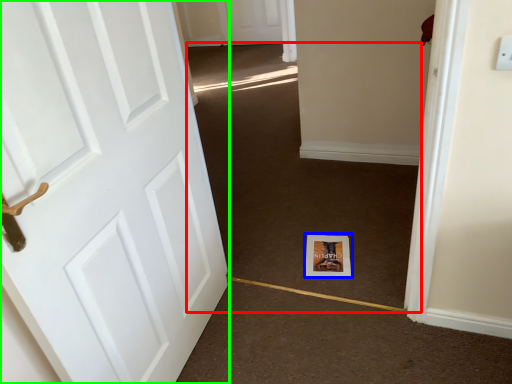
Question: Based on their relative distances, which object is farther from plain (highlighted by a red box)? Choose from print (highlighted by a blue box) and door (highlighted by a green box).

Choices:
 (A) print
 (B) door

Answer: (B)